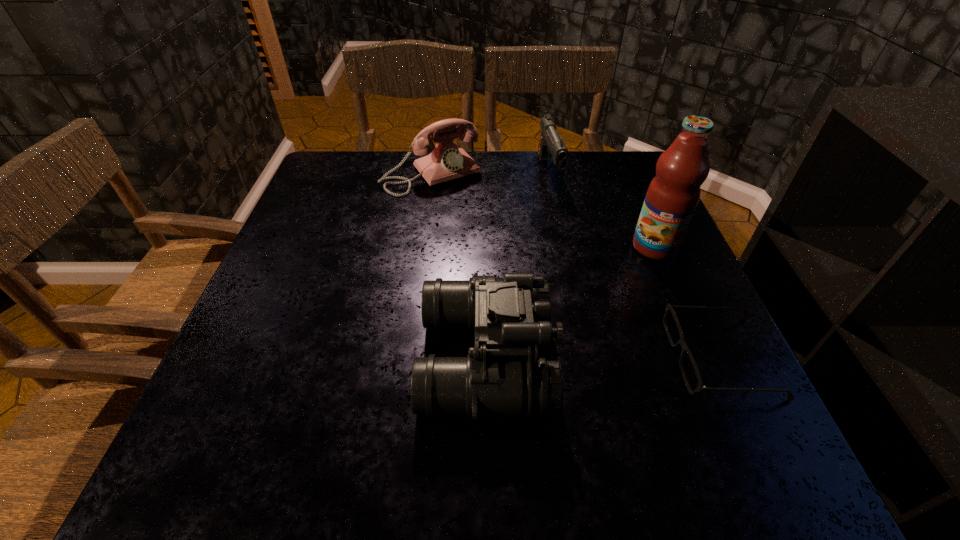
The width and height of the screenshot is (960, 540). I want to click on free space located 0.150m on the dial of the telephone, so click(480, 227).

The width and height of the screenshot is (960, 540). I want to click on vacant space located on the dial of the telephone, so click(520, 276).

Identify the location of free point located 0.300m on the dial of the telephone. The width and height of the screenshot is (960, 540). (511, 265).

What are the coordinates of `vacant space located 0.090m on the front label of the tallest object` in the screenshot? It's located at (636, 285).

Where is `free space located on the front label of the tallest object`? The height and width of the screenshot is (540, 960). free space located on the front label of the tallest object is located at coordinates (610, 337).

I want to click on free location located on the front label of the tallest object, so click(x=638, y=279).

Locate an element on the screen. The width and height of the screenshot is (960, 540). vacant space positioned in the direction the gun is aimed is located at coordinates (560, 207).

Locate an element on the screen. This screenshot has height=540, width=960. vacant space located 0.200m in the direction the gun is aimed is located at coordinates (574, 243).

This screenshot has width=960, height=540. What are the coordinates of `free space located 0.050m in the direction the gun is aimed` in the screenshot? It's located at (559, 205).

Find the location of a particular element. The width and height of the screenshot is (960, 540). telephone positioned at the far edge is located at coordinates (446, 161).